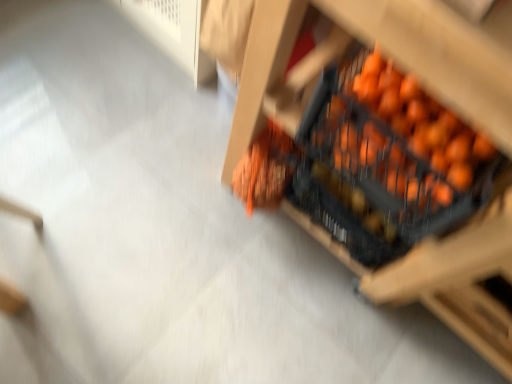
Question: From the image's perspective, is orange matte crate at center-right positioned above or below orange matte crate at center?

Choices:
 (A) below
 (B) above

Answer: (A)

Question: Considering the relative positions of orange matte crate at center-right and orange matte crate at center in the image provided, is orange matte crate at center-right to the left or to the right of orange matte crate at center?

Choices:
 (A) left
 (B) right

Answer: (A)

Question: In the image, is orange matte crate at center-right positioned in front of or behind orange matte crate at center?

Choices:
 (A) behind
 (B) front

Answer: (A)

Question: From a real-world perspective, is orange matte crate at center above or below orange matte crate at center-right?

Choices:
 (A) above
 (B) below

Answer: (B)

Question: Considering the relative positions of orange matte crate at center and orange matte crate at center-right in the image provided, is orange matte crate at center to the left or to the right of orange matte crate at center-right?

Choices:
 (A) right
 (B) left

Answer: (A)

Question: Considering the positions of orange matte crate at center and orange matte crate at center-right in the image, is orange matte crate at center bigger or smaller than orange matte crate at center-right?

Choices:
 (A) big
 (B) small

Answer: (A)

Question: From the image's perspective, is orange matte crate at center positioned above or below orange matte crate at center-right?

Choices:
 (A) below
 (B) above

Answer: (B)